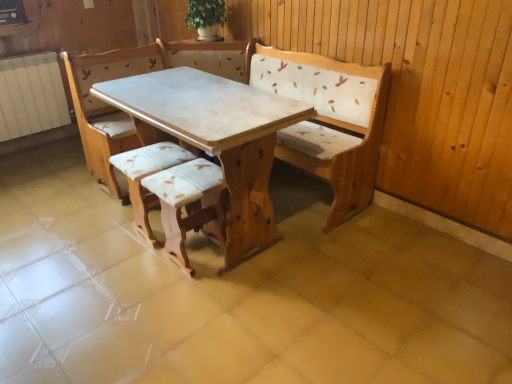
At what (x,y) coordinates should I click in order to perform the action: click on unoccupied area in front of white marble table at center. Please return your answer as a coordinate pair (x, y). This screenshot has width=512, height=384. Looking at the image, I should click on (188, 321).